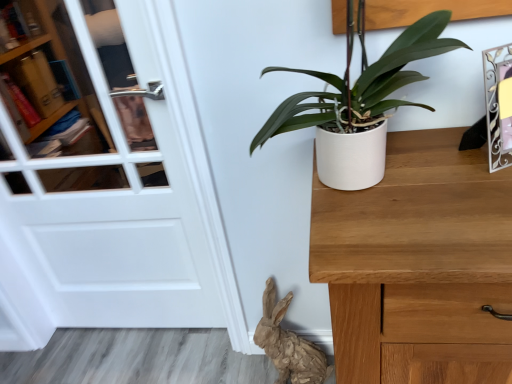
Question: From the image's perspective, does metallic silver picture frame at upper right appear lower than white glossy door at left?

Choices:
 (A) yes
 (B) no

Answer: (B)

Question: Is metallic silver picture frame at upper right positioned behind white glossy door at left?

Choices:
 (A) no
 (B) yes

Answer: (A)

Question: Could you tell me if metallic silver picture frame at upper right is facing white glossy door at left?

Choices:
 (A) no
 (B) yes

Answer: (A)

Question: Considering the relative positions of metallic silver picture frame at upper right and white glossy door at left in the image provided, is metallic silver picture frame at upper right to the right of white glossy door at left from the viewer's perspective?

Choices:
 (A) yes
 (B) no

Answer: (A)

Question: Can you confirm if metallic silver picture frame at upper right is shorter than white glossy door at left?

Choices:
 (A) yes
 (B) no

Answer: (A)

Question: Could white glossy door at left be considered to be inside metallic silver picture frame at upper right?

Choices:
 (A) no
 (B) yes

Answer: (A)

Question: Can brown paper rabbit at lower center be found inside white matte pot at center-right?

Choices:
 (A) no
 (B) yes

Answer: (A)

Question: Is white matte pot at center-right oriented towards brown paper rabbit at lower center?

Choices:
 (A) no
 (B) yes

Answer: (A)

Question: Is white matte pot at center-right in contact with brown paper rabbit at lower center?

Choices:
 (A) yes
 (B) no

Answer: (B)

Question: Does white matte pot at center-right appear on the right side of brown paper rabbit at lower center?

Choices:
 (A) no
 (B) yes

Answer: (B)

Question: Is white matte pot at center-right at the left side of brown paper rabbit at lower center?

Choices:
 (A) yes
 (B) no

Answer: (B)

Question: From a real-world perspective, is white matte pot at center-right under brown paper rabbit at lower center?

Choices:
 (A) yes
 (B) no

Answer: (B)

Question: Is white glossy door at left shorter than brown paper rabbit at lower center?

Choices:
 (A) yes
 (B) no

Answer: (B)